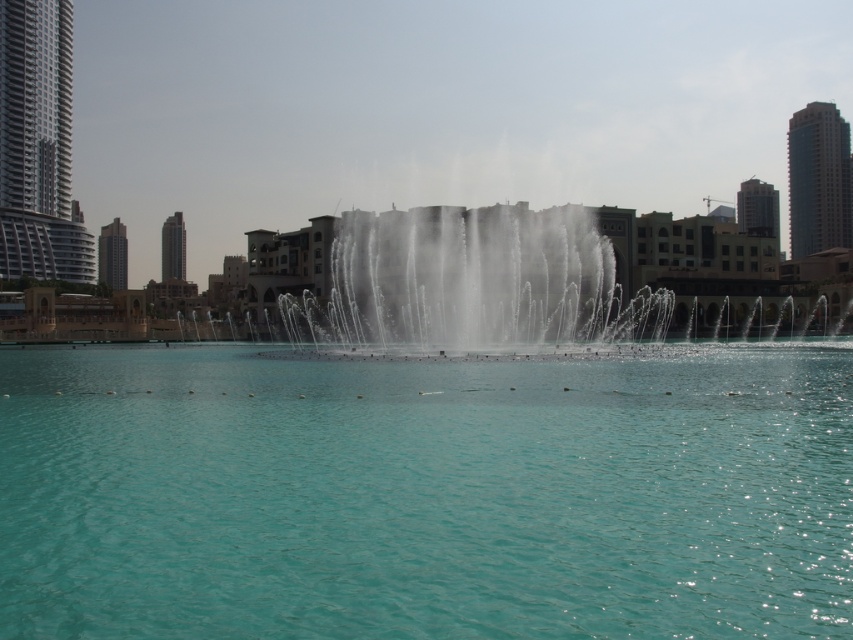
Question: Which object is farther from the camera taking this photo?

Choices:
 (A) clear blue water at center
 (B) clear water at center

Answer: (B)

Question: Can you confirm if clear blue water at center is thinner than clear water at center?

Choices:
 (A) yes
 (B) no

Answer: (A)

Question: Does clear blue water at center appear over clear water at center?

Choices:
 (A) yes
 (B) no

Answer: (B)

Question: Which point is closer to the camera?

Choices:
 (A) (657, 339)
 (B) (332, 484)

Answer: (B)

Question: Is clear blue water at center to the right of clear water at center from the viewer's perspective?

Choices:
 (A) yes
 (B) no

Answer: (B)

Question: Among these objects, which one is nearest to the camera?

Choices:
 (A) clear water at center
 (B) clear blue water at center

Answer: (B)